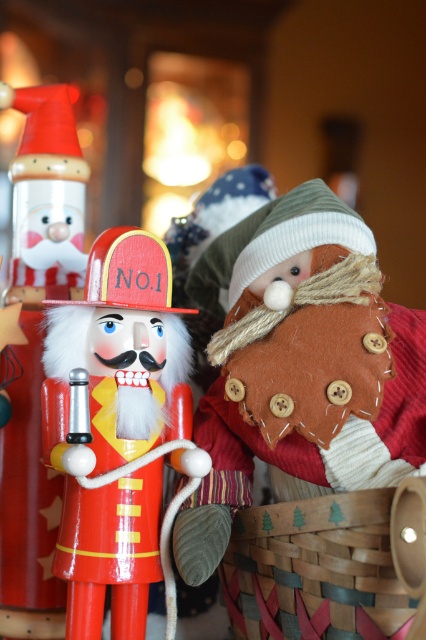
Question: Can you confirm if brown felt santa at center is thinner than woven wood basket at lower right?

Choices:
 (A) no
 (B) yes

Answer: (A)

Question: Which point is closer to the camera?

Choices:
 (A) (0, 419)
 (B) (420, 611)
 (C) (74, 477)
 (D) (308, 332)

Answer: (B)

Question: Which is farther from the wooden nutcracker at left?

Choices:
 (A) shiny red wood nutcracker at center
 (B) woven wood basket at lower right
 (C) brown felt santa at center

Answer: (B)

Question: Which point is closer to the camera?

Choices:
 (A) woven wood basket at lower right
 (B) brown felt santa at center
 (C) wooden nutcracker at left

Answer: (A)

Question: Is brown felt santa at center bigger than woven wood basket at lower right?

Choices:
 (A) no
 (B) yes

Answer: (B)

Question: From the image, what is the correct spatial relationship of shiny red wood nutcracker at center in relation to wooden nutcracker at left?

Choices:
 (A) right
 (B) left

Answer: (A)